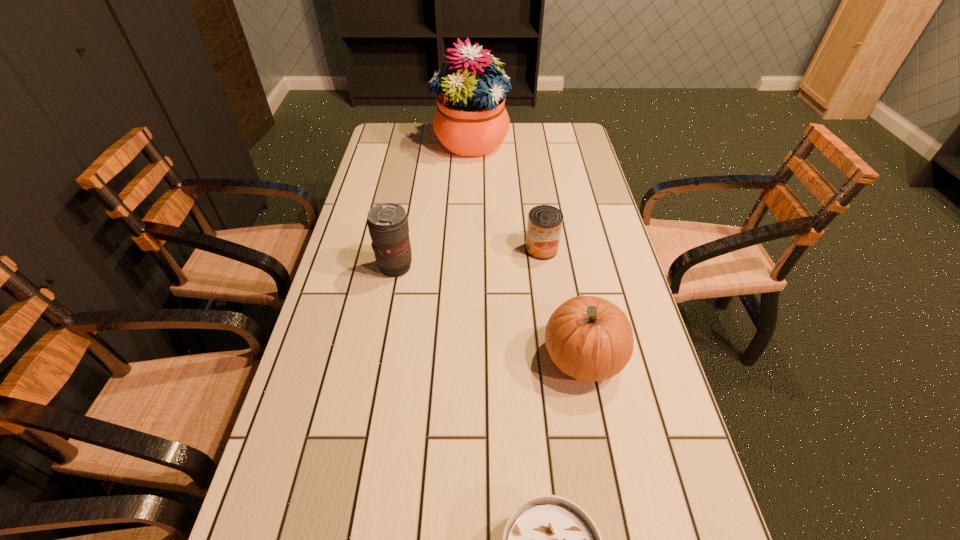
At what (x,y) coordinates should I click in order to perform the action: click on object that is the fourth closest one to the telephoto lens. Please return your answer as a coordinate pair (x, y). The width and height of the screenshot is (960, 540). Looking at the image, I should click on (548, 539).

In order to click on object that can be found as the fourth closest to the soup bowl in this screenshot , I will do `click(470, 120)`.

What are the coordinates of `vacant space that satisfies the following two spatial constraints: 1. on the front side of the can; 2. on the side of the telephoto lens where the control switches are located` in the screenshot? It's located at (544, 267).